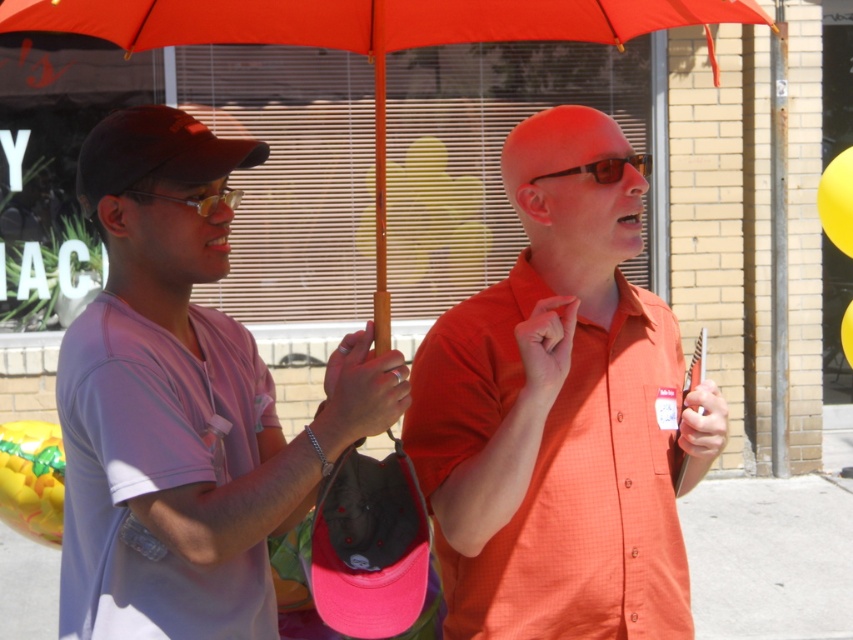
You are a photographer trying to capture a group photo of the orange matte shirt at center and the yellow rubber balloon at lower left. Which object is wider so that you can adjust your camera angle accordingly?

The orange matte shirt at center is wider than the yellow rubber balloon at lower left, so you should adjust your camera angle to focus on the orange matte shirt at center to capture its width properly.

You are a photographer trying to capture a photo of the orange matte shirt at center and the yellow rubber balloon at lower left. Which object should you focus on first if you want to ensure both are in the frame without moving the camera? Explain your reasoning based on their sizes.

The orange matte shirt at center is larger in size than the yellow rubber balloon at lower left. To ensure both are in the frame without moving the camera, focus on the larger object first, which is the orange matte shirt at center, as it requires more space and adjusting the camera settings for it would naturally include the smaller yellow rubber balloon at lower left in the composition.